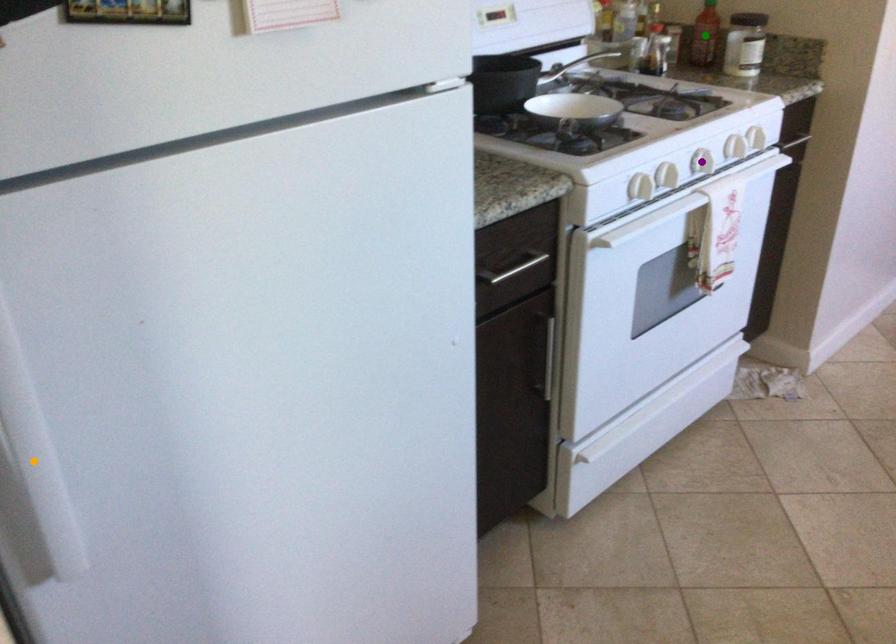
Order these from nearest to farthest:
1. green point
2. purple point
3. orange point

orange point → purple point → green point